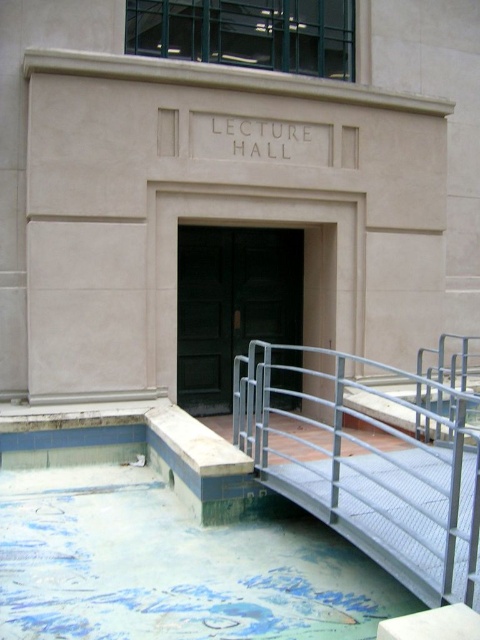
You are a delivery person carrying a large package and need to enter the LECTURE HALL. You see the metal mesh ramp at lower center and the green matte door at center. Which path is shorter for you to reach the door?

The metal mesh ramp at lower center is shorter than the green matte door at center, so the ramp is the shorter path to reach the door.